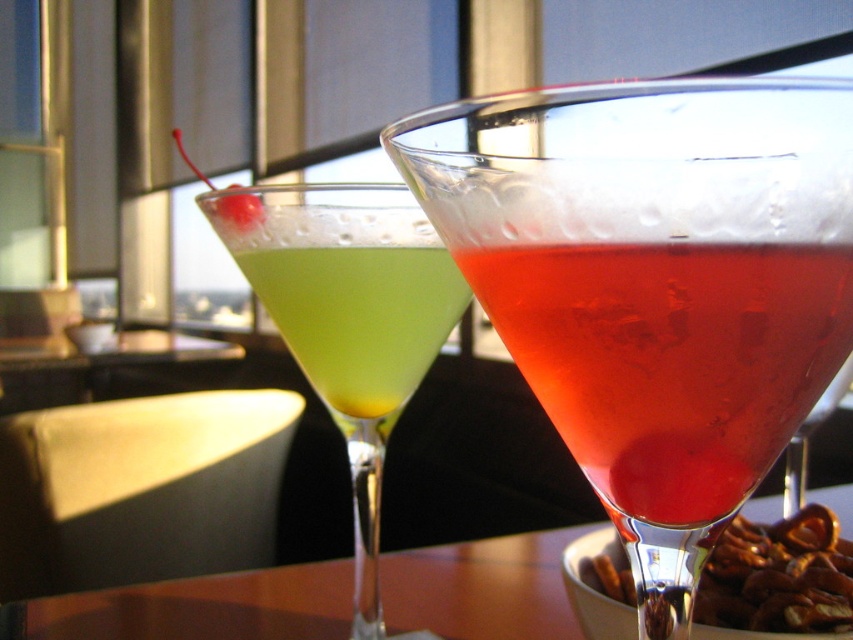
Which is more to the right, translucent glass cocktail at center or green translucent liquid at center?

translucent glass cocktail at center is more to the right.

Is point (500, 227) more distant than point (340, 401)?

No, (500, 227) is in front of (340, 401).

Identify the location of translucent glass cocktail at center. This screenshot has width=853, height=640. (654, 282).

Does translucent glass cocktail at center have a lesser width compared to wooden table at center?

Indeed, translucent glass cocktail at center has a lesser width compared to wooden table at center.

At what (x,y) coordinates should I click in order to perform the action: click on translucent glass cocktail at center. Please return your answer as a coordinate pair (x, y). This screenshot has height=640, width=853. Looking at the image, I should click on (654, 282).

Does point (527, 246) lie in front of point (236, 595)?

Yes, it is in front of point (236, 595).

You are a GUI agent. You are given a task and a screenshot of the screen. Output one action in this format:
    pyautogui.click(x=<x>, y=<y>)
    Task: Click on the translucent glass cocktail at center
    
    Given the screenshot: What is the action you would take?
    pyautogui.click(x=654, y=282)

The image size is (853, 640). What do you see at coordinates (778, 577) in the screenshot?
I see `brown crunchy pretzel at lower right` at bounding box center [778, 577].

Find the location of a particular element. This screenshot has width=853, height=640. brown crunchy pretzel at lower right is located at coordinates (778, 577).